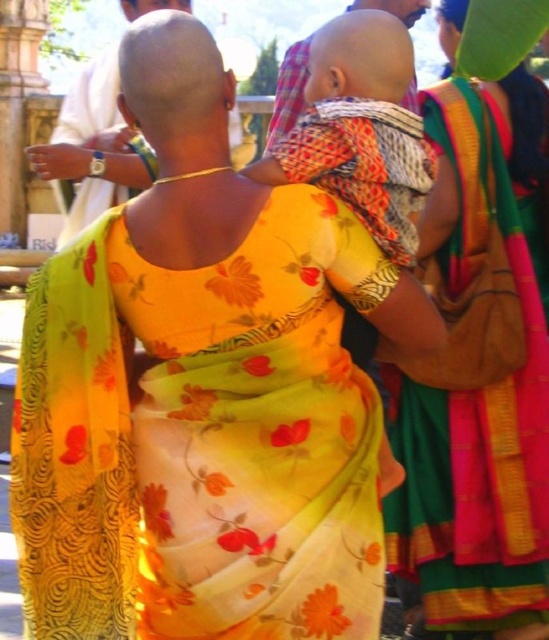
You are an anthropologist observing the scene and want to describe the clothing details of the central woman. Which item is positioned higher on her body between the yellow floral sari at center and the matte gold necklace at upper center?

The matte gold necklace at upper center is positioned higher on her body than the yellow floral sari at center.

You are an observer looking at the scene. Which object has a smaller width between the yellow floral sari at center and the matte gold necklace at upper center?

The yellow floral sari at center has a lesser width compared to the matte gold necklace at upper center.